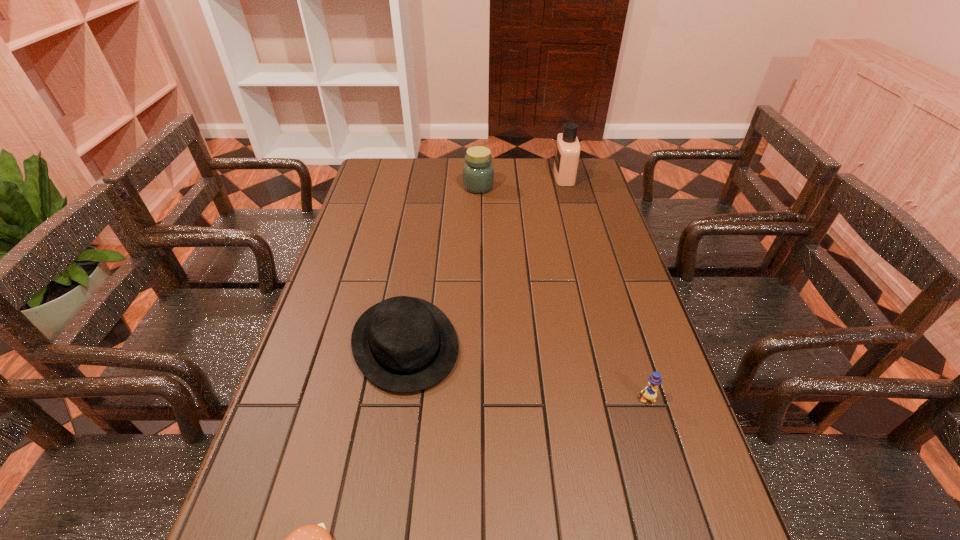
In order to click on perfume located in the far edge section of the desktop in this screenshot , I will do `click(567, 152)`.

At what (x,y) coordinates should I click in order to perform the action: click on jar that is at the far edge. Please return your answer as a coordinate pair (x, y). Looking at the image, I should click on (478, 173).

Where is `object that is at the left edge`? object that is at the left edge is located at coordinates (403, 344).

Where is `perfume that is positioned at the right edge`? This screenshot has width=960, height=540. perfume that is positioned at the right edge is located at coordinates (567, 152).

The image size is (960, 540). What are the coordinates of `duckling present at the right edge` in the screenshot? It's located at (650, 392).

Find the location of `object at the far right corner`. object at the far right corner is located at coordinates (567, 152).

The image size is (960, 540). I want to click on vacant area at the far edge, so click(545, 177).

At what (x,y) coordinates should I click in order to perform the action: click on vacant area at the left edge of the desktop. Please return your answer as a coordinate pair (x, y). The height and width of the screenshot is (540, 960). Looking at the image, I should click on (398, 206).

Where is `vacant area at the right edge`? Image resolution: width=960 pixels, height=540 pixels. vacant area at the right edge is located at coordinates (656, 335).

This screenshot has height=540, width=960. In the image, there is a desktop. Identify the location of vacant space at the far left corner. (362, 184).